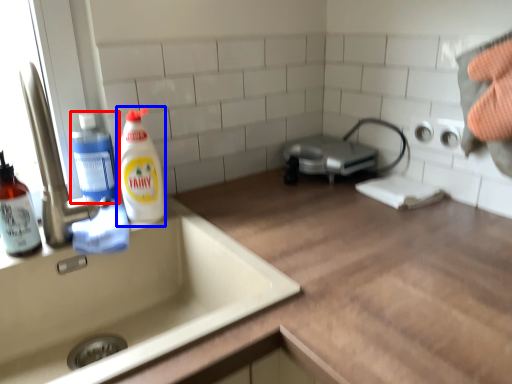
Question: Which object appears closest to the camera in this image, cleaning product (highlighted by a red box) or cleaning product (highlighted by a blue box)?

Choices:
 (A) cleaning product
 (B) cleaning product

Answer: (B)